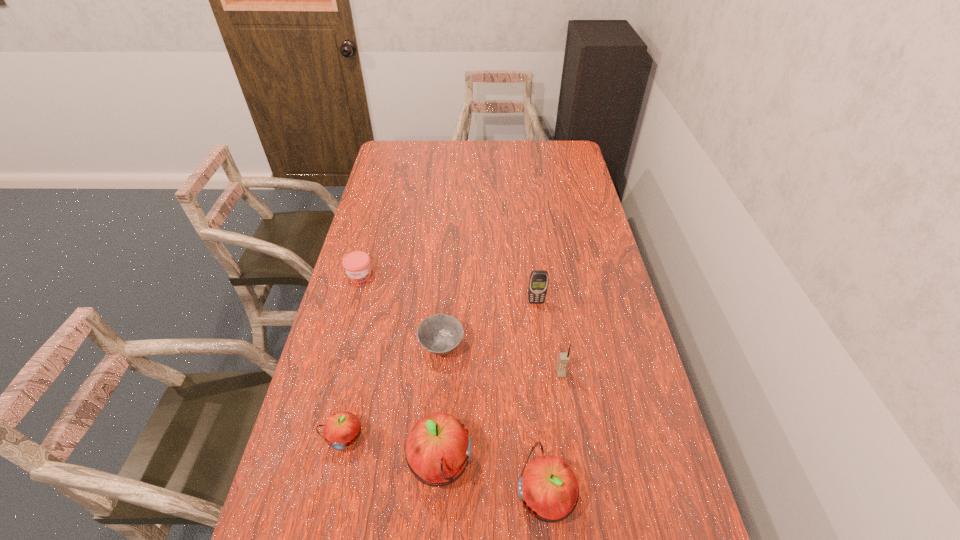
This screenshot has width=960, height=540. In order to click on free space between the leftmost apple and the farthest object in this screenshot , I will do `click(352, 356)`.

Locate an element on the screen. The height and width of the screenshot is (540, 960). blank region between the second apple from right to left and the farther cellular telephone is located at coordinates (488, 384).

Locate an element on the screen. vacant space that is in between the leftmost apple and the right cellular telephone is located at coordinates (452, 406).

Locate an element on the screen. Image resolution: width=960 pixels, height=540 pixels. object identified as the fourth closest to the jam is located at coordinates (438, 449).

Identify which object is the third closest to the farther cellular telephone. Please provide its 2D coordinates. Your answer should be formatted as a tuple, i.e. [(x, y)], where the tuple contains the x and y coordinates of a point satisfying the conditions above.

[(438, 449)]

The image size is (960, 540). I want to click on apple object that ranks as the closest to the third farthest object, so click(x=438, y=449).

Point out which apple is positioned as the second nearest to the fifth nearest object. Please provide its 2D coordinates. Your answer should be formatted as a tuple, i.e. [(x, y)], where the tuple contains the x and y coordinates of a point satisfying the conditions above.

[(341, 430)]

I want to click on free space that satisfies the following two spatial constraints: 1. on the front label of the farthest object; 2. on the left side of the rightmost apple, so click(x=300, y=496).

Where is `free location that satisfies the following two spatial constraints: 1. on the front label of the second shortest apple; 2. on the left side of the jam`? Image resolution: width=960 pixels, height=540 pixels. free location that satisfies the following two spatial constraints: 1. on the front label of the second shortest apple; 2. on the left side of the jam is located at coordinates (300, 496).